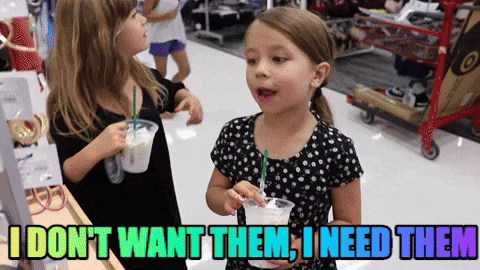
The image size is (480, 270). In order to click on white floor in this screenshot , I will do `click(51, 89)`.